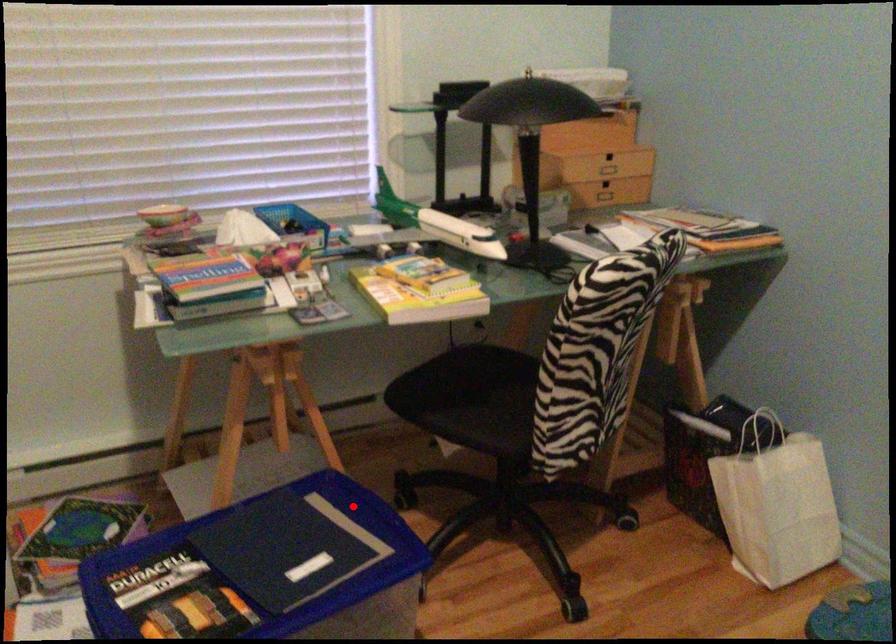
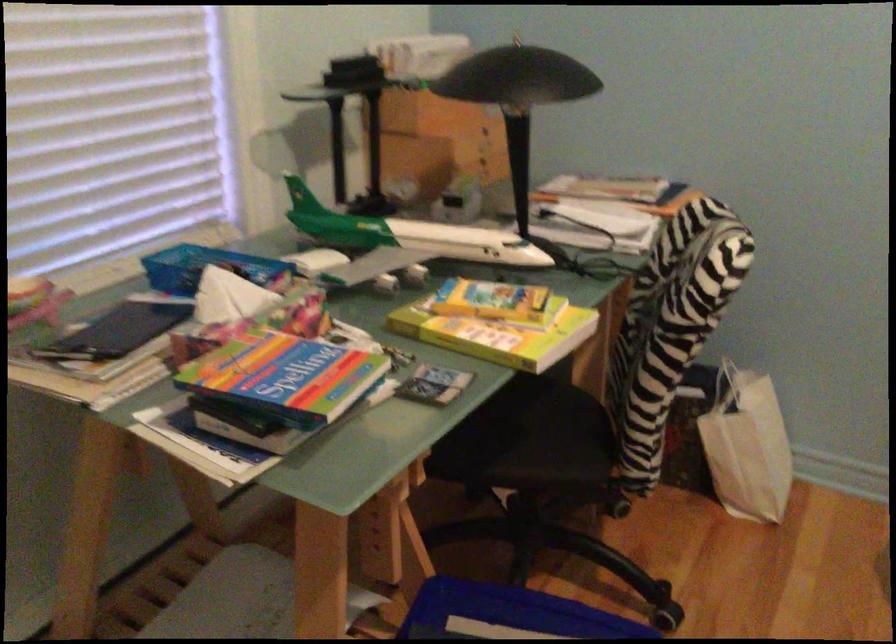
Question: I am providing you with two images of the same scene from different viewpoints. In image1, a red point is highlighted. Considering the same 3D point in image2, which of the following is correct?

Choices:
 (A) It is closer
 (B) It is farther

Answer: (A)